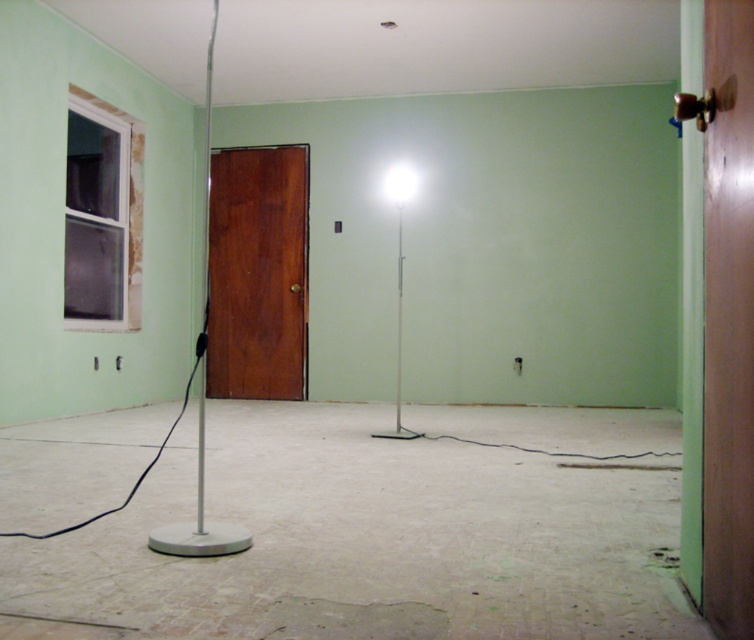
Between shiny brown door at center and white glossy floor lamp at center, which one appears on the right side from the viewer's perspective?

white glossy floor lamp at center is more to the right.

Can you confirm if shiny brown door at center is positioned below white glossy floor lamp at center?

Yes, shiny brown door at center is below white glossy floor lamp at center.

Locate an element on the screen. The image size is (754, 640). shiny brown door at center is located at coordinates (256, 273).

Is point (731, 163) more distant than point (397, 353)?

No, (731, 163) is in front of (397, 353).

Between wooden door at right and white glossy floor lamp at center, which one appears on the right side from the viewer's perspective?

From the viewer's perspective, wooden door at right appears more on the right side.

Is point (740, 372) positioned behind point (397, 358)?

No, it is in front of (397, 358).

Find the location of `wooden door at right`. wooden door at right is located at coordinates (728, 321).

Who is more forward, (710, 476) or (290, 157)?

Point (710, 476)

Does point (737, 330) come behind point (267, 225)?

No, it is not.

Who is more forward, (x=728, y=444) or (x=299, y=252)?

Point (x=728, y=444)

Image resolution: width=754 pixels, height=640 pixels. Find the location of `wooden door at right`. wooden door at right is located at coordinates (728, 321).